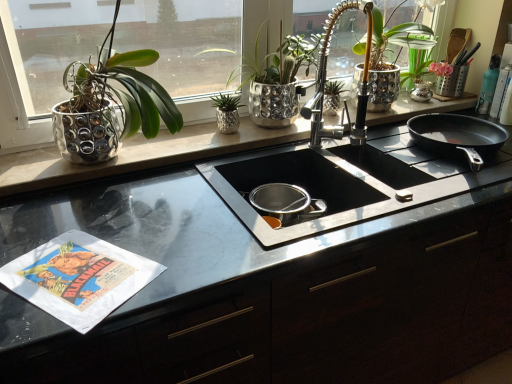
Question: Is shiny metallic plant at left, marked as the 4th houseplant in a right-to-left arrangement, directly adjacent to black glossy countertop at center?

Choices:
 (A) yes
 (B) no

Answer: (B)

Question: From the image's perspective, is shiny metallic plant at left, which appears as the first houseplant when viewed from the left, located beneath black glossy countertop at center?

Choices:
 (A) yes
 (B) no

Answer: (B)

Question: Is shiny metallic plant at left, marked as the 4th houseplant in a right-to-left arrangement, in front of black glossy countertop at center?

Choices:
 (A) yes
 (B) no

Answer: (B)

Question: Is shiny metallic plant at left, which appears as the first houseplant when viewed from the left, not within black glossy countertop at center?

Choices:
 (A) no
 (B) yes

Answer: (B)

Question: From a real-world perspective, is shiny metallic plant at left, which appears as the first houseplant when viewed from the left, physically above black glossy countertop at center?

Choices:
 (A) no
 (B) yes

Answer: (B)

Question: Relative to green metallic plant at center, which ranks as the third houseplant in right-to-left order, is black non-stick frying pan at right in front or behind?

Choices:
 (A) behind
 (B) front

Answer: (B)

Question: Is black non-stick frying pan at right to the left or to the right of green metallic plant at center, which is the 2th houseplant in left-to-right order, in the image?

Choices:
 (A) left
 (B) right

Answer: (B)

Question: Based on their sizes in the image, would you say black non-stick frying pan at right is bigger or smaller than green metallic plant at center, which is the 2th houseplant in left-to-right order?

Choices:
 (A) big
 (B) small

Answer: (A)

Question: Would you say black non-stick frying pan at right is inside or outside green metallic plant at center, which is the 2th houseplant in left-to-right order?

Choices:
 (A) inside
 (B) outside

Answer: (B)

Question: From a real-world perspective, relative to shiny silver pot at upper right, which is counted as the 4th houseplant, starting from the left, is shiny metallic pot at center, marked as the third houseplant in a left-to-right arrangement, vertically above or below?

Choices:
 (A) above
 (B) below

Answer: (B)

Question: Would you say shiny metallic pot at center, marked as the 2th houseplant in a right-to-left arrangement, is to the left or to the right of shiny silver pot at upper right, which is counted as the 4th houseplant, starting from the left, in the picture?

Choices:
 (A) left
 (B) right

Answer: (A)

Question: In terms of size, does shiny metallic pot at center, marked as the 2th houseplant in a right-to-left arrangement, appear bigger or smaller than shiny silver pot at upper right, which is counted as the 4th houseplant, starting from the left?

Choices:
 (A) small
 (B) big

Answer: (A)

Question: Is point (309, 61) positioned closer to the camera than point (394, 29)?

Choices:
 (A) farther
 (B) closer

Answer: (B)

Question: Considering the relative positions of shiny metallic pot at center, marked as the third houseplant in a left-to-right arrangement, and green metallic plant at center, which ranks as the third houseplant in right-to-left order, in the image provided, is shiny metallic pot at center, marked as the third houseplant in a left-to-right arrangement, to the left or to the right of green metallic plant at center, which ranks as the third houseplant in right-to-left order,?

Choices:
 (A) right
 (B) left

Answer: (A)

Question: Considering the positions of shiny metallic pot at center, marked as the third houseplant in a left-to-right arrangement, and green metallic plant at center, which ranks as the third houseplant in right-to-left order, in the image, is shiny metallic pot at center, marked as the third houseplant in a left-to-right arrangement, taller or shorter than green metallic plant at center, which ranks as the third houseplant in right-to-left order,?

Choices:
 (A) short
 (B) tall

Answer: (B)